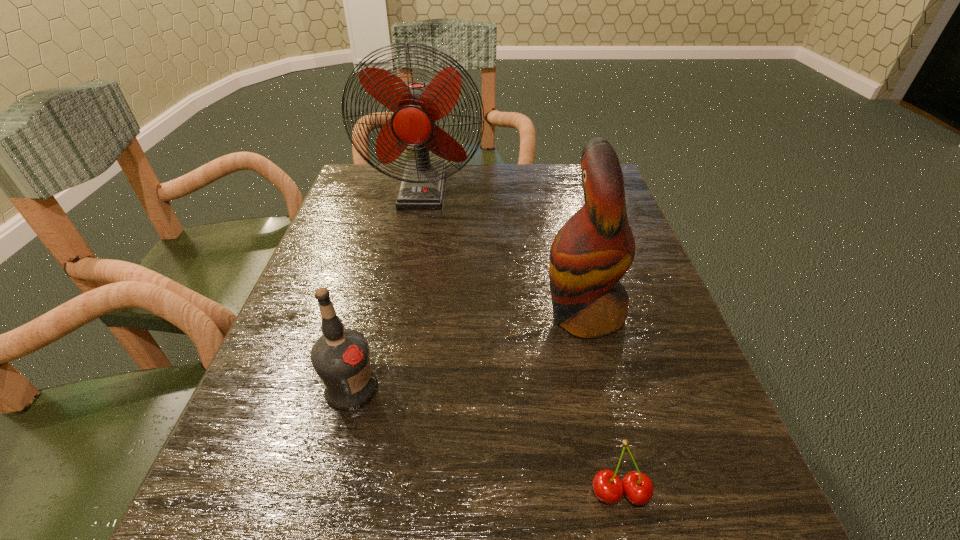
Locate an element on the screen. free spot between the farthest object and the second nearest object is located at coordinates (387, 289).

This screenshot has height=540, width=960. What are the coordinates of `vacant space in between the shortest object and the fan` in the screenshot? It's located at (521, 341).

This screenshot has height=540, width=960. I want to click on free space between the nearest object and the farthest object, so click(x=521, y=341).

Find the location of a particular element. The height and width of the screenshot is (540, 960). free space between the cherry and the second shortest object is located at coordinates (486, 441).

You are a GUI agent. You are given a task and a screenshot of the screen. Output one action in this format:
    pyautogui.click(x=<x>, y=<y>)
    Task: Click on the vacant area between the cherry and the farthest object
    The image size is (960, 540).
    Given the screenshot: What is the action you would take?
    pyautogui.click(x=521, y=341)

Locate which object is the second closest to the third farthest object. Please provide its 2D coordinates. Your answer should be formatted as a tuple, i.e. [(x, y)], where the tuple contains the x and y coordinates of a point satisfying the conditions above.

[(638, 488)]

Where is `object that is the third nearest to the vodka`? object that is the third nearest to the vodka is located at coordinates (416, 106).

The width and height of the screenshot is (960, 540). Identify the location of free location that satisfies the following two spatial constraints: 1. on the front-facing side of the farthest object; 2. on the front label of the third farthest object. (384, 388).